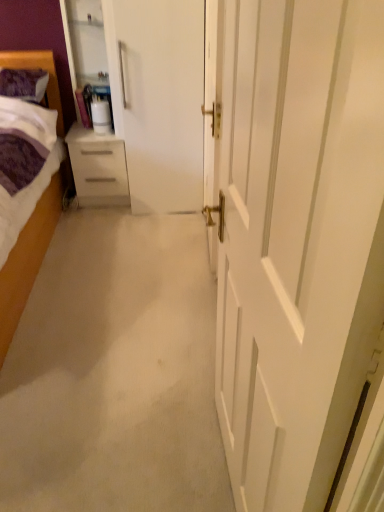
Where is `white glossy door at center`? This screenshot has width=384, height=512. white glossy door at center is located at coordinates (212, 100).

Image resolution: width=384 pixels, height=512 pixels. In order to click on white glossy chest of drawers at left in this screenshot , I will do `click(98, 167)`.

Is white glossy door at center outside of transparent glass cabinet at upper left?

white glossy door at center is positioned outside transparent glass cabinet at upper left.

Is white glossy door at center far away from transparent glass cabinet at upper left?

That's right, there is a large distance between white glossy door at center and transparent glass cabinet at upper left.

Based on the photo, which of these two, white glossy door at center or transparent glass cabinet at upper left, stands taller?

white glossy door at center.

At what (x,y) coordinates should I click in order to perform the action: click on door in front of the white glossy chest of drawers at left. Please return your answer as a coordinate pair (x, y). Image resolution: width=384 pixels, height=512 pixels. Looking at the image, I should click on (212, 100).

Can you confirm if white glossy chest of drawers at left is shorter than white glossy door at center?

Yes, white glossy chest of drawers at left is shorter than white glossy door at center.

Considering the positions of point (98, 198) and point (203, 108), is point (98, 198) closer or farther from the camera than point (203, 108)?

Point (98, 198) is farther from the camera than point (203, 108).

From the image's perspective, is white glossy chest of drawers at left above or below white glossy door at center?

Clearly, from the image's perspective, white glossy chest of drawers at left is above white glossy door at center.

Is purple soft fabric bed at left next to purple soft pillow at upper left?

No.

Is purple soft fabric bed at left not within purple soft pillow at upper left?

purple soft fabric bed at left is positioned outside purple soft pillow at upper left.

Is purple soft fabric bed at left taller or shorter than purple soft pillow at upper left?

Considering their sizes, purple soft fabric bed at left has more height than purple soft pillow at upper left.

From the image's perspective, is purple soft fabric bed at left beneath purple soft pillow at upper left?

Yes.

Identify the location of pillow on the left of the white glossy door at center. This screenshot has height=512, width=384. (24, 84).

How many degrees apart are the facing directions of white glossy door at center and purple soft pillow at upper left?

The angle between the facing direction of white glossy door at center and the facing direction of purple soft pillow at upper left is 90.6 degrees.

How distant is white glossy door at center from purple soft pillow at upper left?

Answer: white glossy door at center is 5.66 feet away from purple soft pillow at upper left.

Considering the positions of objects white glossy door at center and purple soft pillow at upper left in the image provided, who is more to the right, white glossy door at center or purple soft pillow at upper left?

white glossy door at center is more to the right.

Is purple soft fabric bed at left not within transparent glass cabinet at upper left?

purple soft fabric bed at left is positioned outside transparent glass cabinet at upper left.

Considering the positions of point (62, 189) and point (110, 150), is point (62, 189) closer or farther from the camera than point (110, 150)?

Point (62, 189).

Could you tell me if purple soft fabric bed at left is turned towards transparent glass cabinet at upper left?

No, purple soft fabric bed at left is not facing towards transparent glass cabinet at upper left.

This screenshot has height=512, width=384. In order to click on bed below the transparent glass cabinet at upper left (from a real-world perspective) in this screenshot , I will do `click(29, 256)`.

How many degrees apart are the facing directions of white glossy door at center and white glossy chest of drawers at left?

92.3 degrees separate the facing orientations of white glossy door at center and white glossy chest of drawers at left.

Does white glossy door at center turn towards white glossy chest of drawers at left?

No, white glossy door at center is not oriented towards white glossy chest of drawers at left.

Considering the relative sizes of white glossy door at center and white glossy chest of drawers at left in the image provided, is white glossy door at center smaller than white glossy chest of drawers at left?

Yes.

Can you confirm if white glossy door at center is thinner than white glossy chest of drawers at left?

Indeed, white glossy door at center has a lesser width compared to white glossy chest of drawers at left.

Is white glossy chest of drawers at left in front of or behind transparent glass cabinet at upper left in the image?

white glossy chest of drawers at left is behind transparent glass cabinet at upper left.

Identify the location of chest of drawers below the transparent glass cabinet at upper left (from a real-world perspective). (98, 167).

Which is correct: white glossy chest of drawers at left is inside transparent glass cabinet at upper left, or outside of it?

white glossy chest of drawers at left is located beyond the bounds of transparent glass cabinet at upper left.

Considering the sizes of objects white glossy chest of drawers at left and transparent glass cabinet at upper left in the image provided, who is bigger, white glossy chest of drawers at left or transparent glass cabinet at upper left?

Bigger between the two is transparent glass cabinet at upper left.

Where is `door located on the right of transparent glass cabinet at upper left`? The width and height of the screenshot is (384, 512). door located on the right of transparent glass cabinet at upper left is located at coordinates (212, 100).

Where is `chest of drawers lying on the left of white glossy door at center`? Image resolution: width=384 pixels, height=512 pixels. chest of drawers lying on the left of white glossy door at center is located at coordinates (98, 167).

When comparing their distances from white glossy chest of drawers at left, does white glossy door at center or purple soft fabric bed at left seem closer?

purple soft fabric bed at left is closer to white glossy chest of drawers at left.

When comparing their distances from purple soft fabric bed at left, does transparent glass cabinet at upper left or purple soft pillow at upper left seem further?

purple soft pillow at upper left.

From the image, which object appears to be nearer to transparent glass cabinet at upper left, white glossy chest of drawers at left or purple soft fabric bed at left?

white glossy chest of drawers at left.

Estimate the real-world distances between objects in this image. Which object is further from white glossy chest of drawers at left, purple soft fabric bed at left or purple soft pillow at upper left?

Based on the image, purple soft pillow at upper left appears to be further to white glossy chest of drawers at left.

Consider the image. Based on their spatial positions, is purple soft pillow at upper left or white glossy chest of drawers at left further from purple soft fabric bed at left?

The object further to purple soft fabric bed at left is purple soft pillow at upper left.

Estimate the real-world distances between objects in this image. Which object is closer to transparent glass cabinet at upper left, purple soft pillow at upper left or white glossy door at center?

Among the two, purple soft pillow at upper left is located nearer to transparent glass cabinet at upper left.

In the scene shown: From the image, which object appears to be nearer to white glossy chest of drawers at left, purple soft fabric bed at left or white glossy door at center?

Based on the image, purple soft fabric bed at left appears to be nearer to white glossy chest of drawers at left.

When comparing their distances from purple soft pillow at upper left, does purple soft fabric bed at left or white glossy door at center seem closer?

purple soft fabric bed at left.

I want to click on armoire between white glossy door at center and white glossy chest of drawers at left in the front-back direction, so click(x=98, y=89).

Identify the location of armoire located between purple soft fabric bed at left and white glossy chest of drawers at left in the depth direction. (98, 89).

Identify the location of door between purple soft fabric bed at left and purple soft pillow at upper left in the front-back direction. Image resolution: width=384 pixels, height=512 pixels. (212, 100).

Identify the location of pillow between purple soft fabric bed at left and white glossy chest of drawers at left in the front-back direction. This screenshot has height=512, width=384. (24, 84).